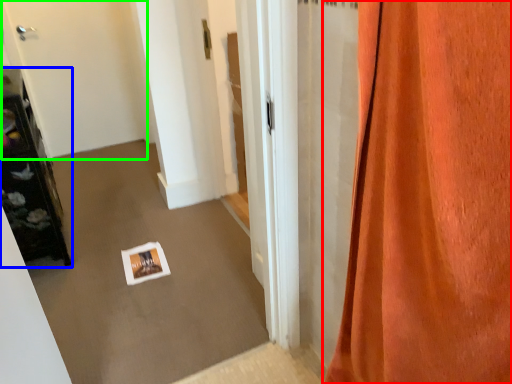
Question: Considering the real-world distances, which object is farthest from curtain (highlighted by a red box)? furniture (highlighted by a blue box) or door (highlighted by a green box)?

Choices:
 (A) furniture
 (B) door

Answer: (B)